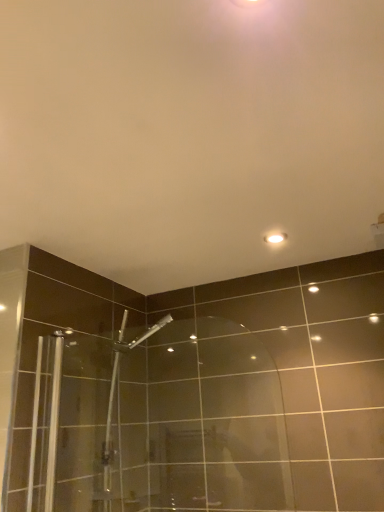
Question: From a real-world perspective, is transparent glass shower door at center physically above white glossy light fixture at upper center?

Choices:
 (A) yes
 (B) no

Answer: (B)

Question: From a real-world perspective, is transparent glass shower door at center located beneath white glossy light fixture at upper center?

Choices:
 (A) yes
 (B) no

Answer: (A)

Question: Considering the relative positions of transparent glass shower door at center and white glossy light fixture at upper center in the image provided, is transparent glass shower door at center in front of white glossy light fixture at upper center?

Choices:
 (A) no
 (B) yes

Answer: (B)

Question: Does transparent glass shower door at center have a lesser width compared to white glossy light fixture at upper center?

Choices:
 (A) no
 (B) yes

Answer: (B)

Question: Would you consider transparent glass shower door at center to be distant from white glossy light fixture at upper center?

Choices:
 (A) yes
 (B) no

Answer: (B)

Question: Does transparent glass shower door at center have a greater height compared to white glossy light fixture at upper center?

Choices:
 (A) yes
 (B) no

Answer: (A)

Question: Is white glossy light fixture at upper center wider than transparent glass shower door at center?

Choices:
 (A) yes
 (B) no

Answer: (A)

Question: From a real-world perspective, is white glossy light fixture at upper center located higher than transparent glass shower door at center?

Choices:
 (A) yes
 (B) no

Answer: (A)

Question: Does white glossy light fixture at upper center appear on the right side of transparent glass shower door at center?

Choices:
 (A) yes
 (B) no

Answer: (A)

Question: Is white glossy light fixture at upper center taller than transparent glass shower door at center?

Choices:
 (A) yes
 (B) no

Answer: (B)

Question: From the image's perspective, would you say white glossy light fixture at upper center is shown under transparent glass shower door at center?

Choices:
 (A) no
 (B) yes

Answer: (A)

Question: Would you say transparent glass shower door at center is part of white glossy light fixture at upper center's contents?

Choices:
 (A) yes
 (B) no

Answer: (B)

Question: From a real-world perspective, is white glossy light fixture at upper center physically located above or below transparent glass shower door at center?

Choices:
 (A) above
 (B) below

Answer: (A)